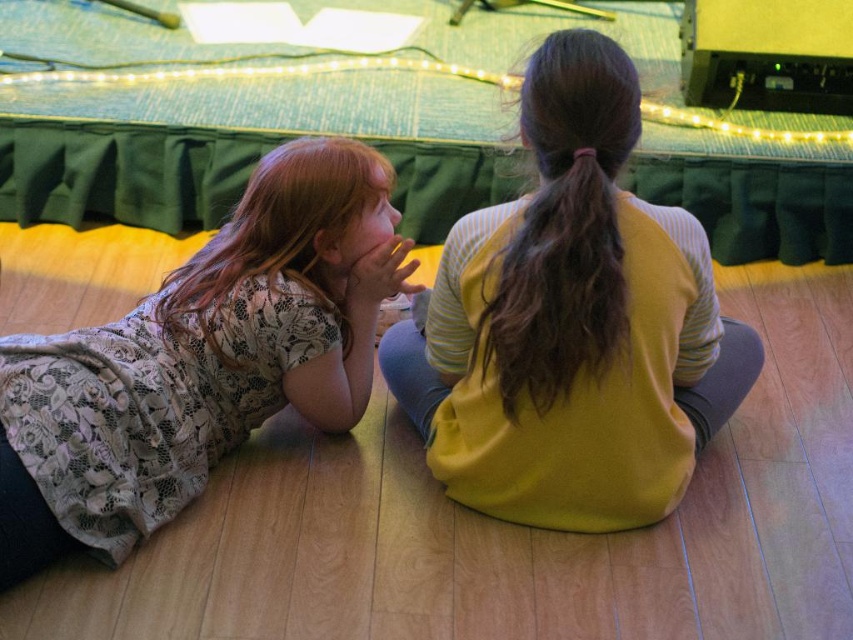
You are a photographer setting up for a stage performance. You need to position a spotlight so it illuminates both the lace fabric dress at lower left and the brown silky hair at center. Based on their positions, where should you aim the spotlight?

The lace fabric dress at lower left is located below brown silky hair at center, so aim the spotlight at the brown silky hair at center to ensure both objects are illuminated since the dress is positioned beneath it.

You are a costume designer preparing for a play. You need to ensure that the lace fabric dress at lower left and the brown silky hair at center are positioned so that the dress doesn not overshadow the hair. Given their sizes, which object should be placed farther back to achieve this?

The lace fabric dress at lower left is wider than the brown silky hair at center. To prevent the dress from overshadowing the hair, the lace fabric dress at lower left should be placed farther back so that its larger size does not dominate the scene.

You are a stagehand who needs to place a microphone exactly at the position of the yellow matte sweater at center. According to the coordinates provided, what are the exact coordinates where you should place the microphone?

The exact coordinates for the yellow matte sweater at center are at point (572, 323).